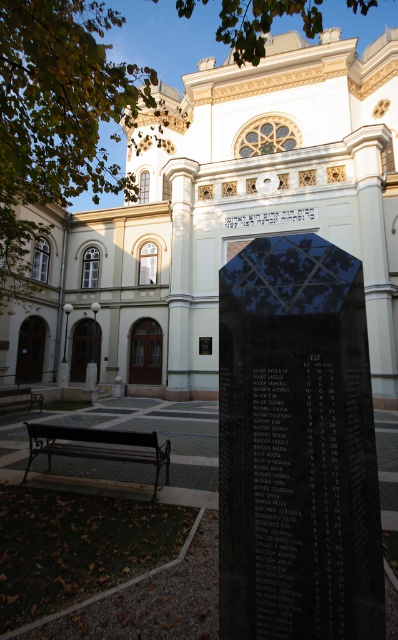
You are planning to place a new flower pot between the black polished stone monument at center and the brown wooden bench at lower left. Given their widths, which object should the flower pot be closer to?

The black polished stone monument at center is thinner than the brown wooden bench at lower left, so the flower pot should be placed closer to the monument to maintain balance between the two objects.